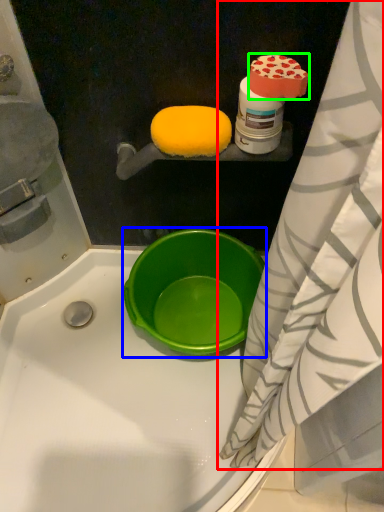
Question: Which object is positioned farthest from curtain (highlighted by a red box)? Select from basin (highlighted by a blue box) and food (highlighted by a green box).

Choices:
 (A) basin
 (B) food

Answer: (B)